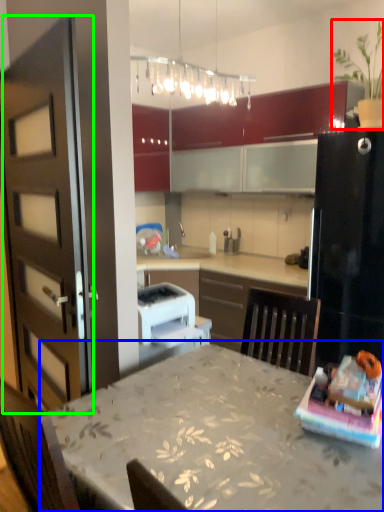
Question: Considering the real-world distances, which object is closest to houseplant (highlighted by a red box)? table (highlighted by a blue box) or door (highlighted by a green box).

Choices:
 (A) table
 (B) door

Answer: (B)